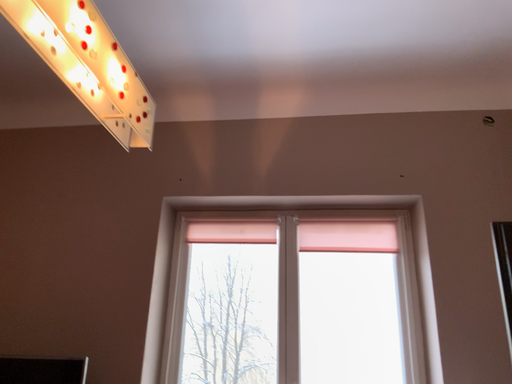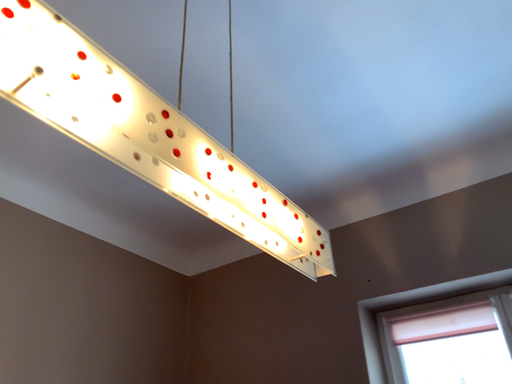
Question: Which way did the camera rotate in the video?

Choices:
 (A) rotated right
 (B) rotated left

Answer: (B)